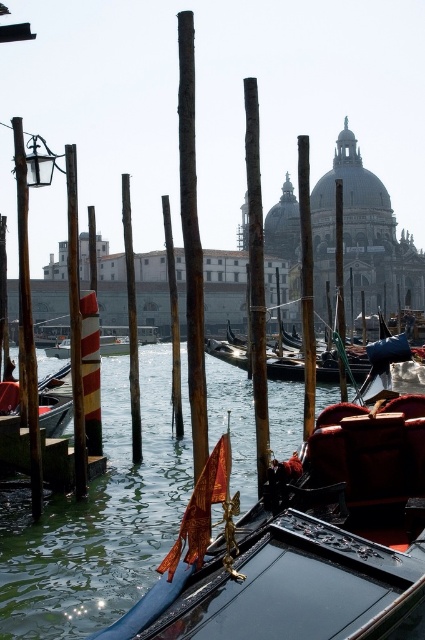
You are a tourist in Venice and want to take a photo of the two poles near the gondola. The smooth brown pole at center and the brown wooden pole at center. Which pole should you focus on if you want to capture the one that takes up more space in the photo?

The brown wooden pole at center takes up more space in the photo than the smooth brown pole at center because the smooth brown pole at center occupies less space than brown wooden pole at center.

You are a tourist standing on the wooden dock at lower left and want to take a photo of the wooden pole at left. Which direction should you face to capture it in your shot?

The wooden pole at left is positioned on the left side of wooden dock at lower left, so you should face to the left to capture it in your shot.

You are a tourist in Venice and want to take a photo of the wooden pole at left and the wooden dock at lower left. Which object should you focus on first if you want to capture both in a single frame without moving your camera?

You should focus on the wooden pole at left first because it is much taller than the wooden dock at lower left, so it will occupy more space in the frame and ensure both are visible.